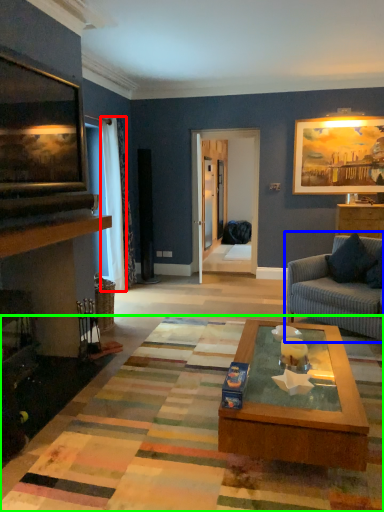
Question: Estimate the real-world distances between objects in this image. Which object is farther from curtain (highlighted by a red box), studio couch (highlighted by a blue box) or mat (highlighted by a green box)?

Choices:
 (A) studio couch
 (B) mat

Answer: (B)